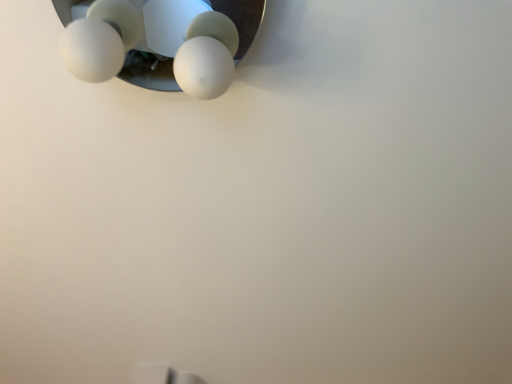
This screenshot has height=384, width=512. Describe the element at coordinates (154, 42) in the screenshot. I see `white matte egg at upper left` at that location.

At what (x,y) coordinates should I click in order to perform the action: click on white matte egg at upper left. Please return your answer as a coordinate pair (x, y). This screenshot has height=384, width=512. Looking at the image, I should click on (154, 42).

Locate an element on the screen. white matte egg at upper left is located at coordinates (154, 42).